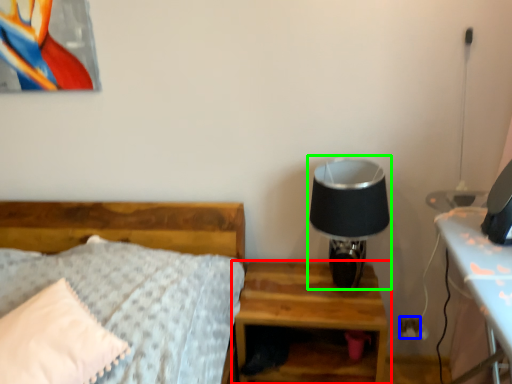
Question: Considering the real-world distances, which object is farthest from nightstand (highlighted by a red box)? electric outlet (highlighted by a blue box) or table lamp (highlighted by a green box)?

Choices:
 (A) electric outlet
 (B) table lamp

Answer: (A)